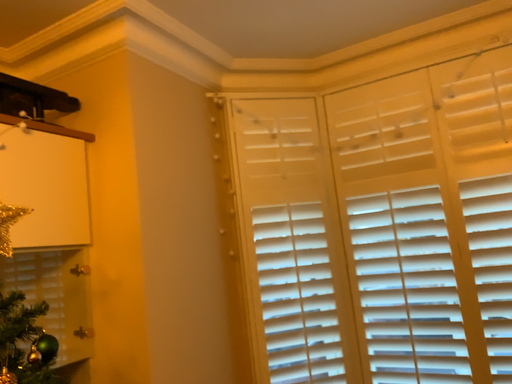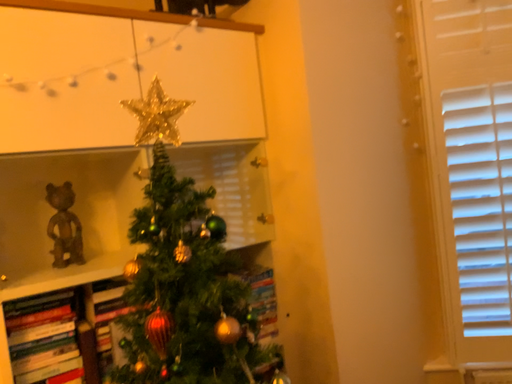
Question: How did the camera likely rotate when shooting the video?

Choices:
 (A) rotated downward
 (B) rotated upward

Answer: (A)